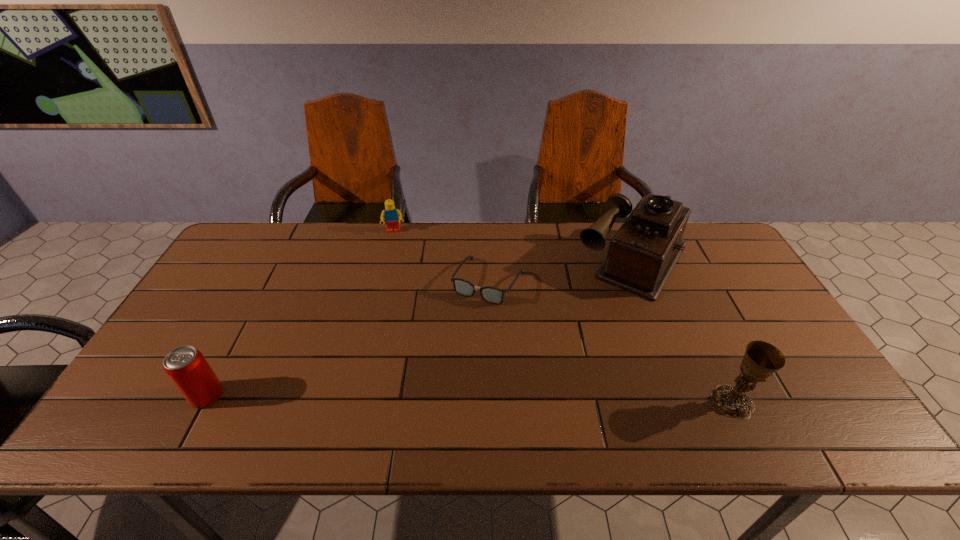
I want to click on vacant space at the left edge of the desktop, so click(226, 317).

You are a GUI agent. You are given a task and a screenshot of the screen. Output one action in this format:
    pyautogui.click(x=<x>, y=<y>)
    Task: Click on the free space at the right edge of the desktop
    
    Given the screenshot: What is the action you would take?
    pyautogui.click(x=786, y=337)

You are a GUI agent. You are given a task and a screenshot of the screen. Output one action in this format:
    pyautogui.click(x=<x>, y=<y>)
    Task: Click on the vacant region at the far right corner
    
    Given the screenshot: What is the action you would take?
    pyautogui.click(x=714, y=225)

Where is `free space between the spectacles and the chalice`? free space between the spectacles and the chalice is located at coordinates (611, 342).

You are a GUI agent. You are given a task and a screenshot of the screen. Output one action in this format:
    pyautogui.click(x=<x>, y=<y>)
    Task: Click on the empty space between the phonograph_record and the chalice
    
    Given the screenshot: What is the action you would take?
    pyautogui.click(x=684, y=330)

Identify the location of vacant area between the chalice and the fourth tallest object. This screenshot has width=960, height=540. (564, 316).

Where is `free point between the can and the fourth object from right to left`? This screenshot has width=960, height=540. free point between the can and the fourth object from right to left is located at coordinates (300, 313).

You are a GUI agent. You are given a task and a screenshot of the screen. Output one action in this format:
    pyautogui.click(x=<x>, y=<y>)
    Task: Click on the vacant space in between the shortest object and the phonograph_record
    
    Given the screenshot: What is the action you would take?
    562,270

This screenshot has height=540, width=960. I want to click on vacant area that lies between the can and the Lego, so click(300, 313).

Where is `free point between the chalice and the spectacles`? The width and height of the screenshot is (960, 540). free point between the chalice and the spectacles is located at coordinates (611, 342).